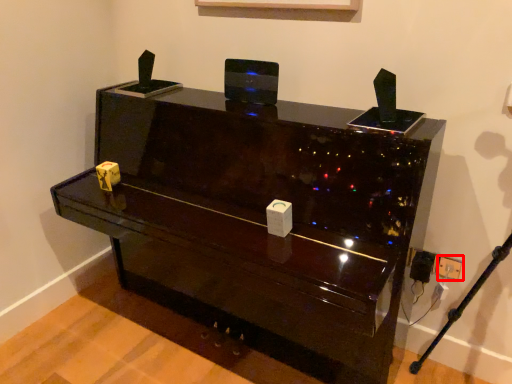
Question: From the image's perspective, considering the relative positions of electric outlet (annotated by the red box) and furniture in the image provided, where is electric outlet (annotated by the red box) located with respect to the staircase?

Choices:
 (A) above
 (B) below

Answer: (B)